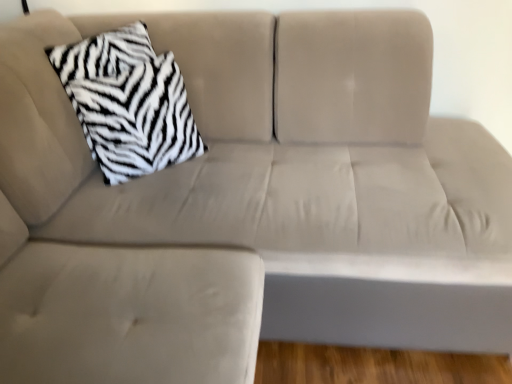
In order to click on zebra-patterned fur pillow at upper left in this screenshot , I will do `click(128, 102)`.

What do you see at coordinates (128, 102) in the screenshot? This screenshot has width=512, height=384. I see `zebra-patterned fur pillow at upper left` at bounding box center [128, 102].

Where is `zebra-patterned fur pillow at upper left`? This screenshot has height=384, width=512. zebra-patterned fur pillow at upper left is located at coordinates (128, 102).